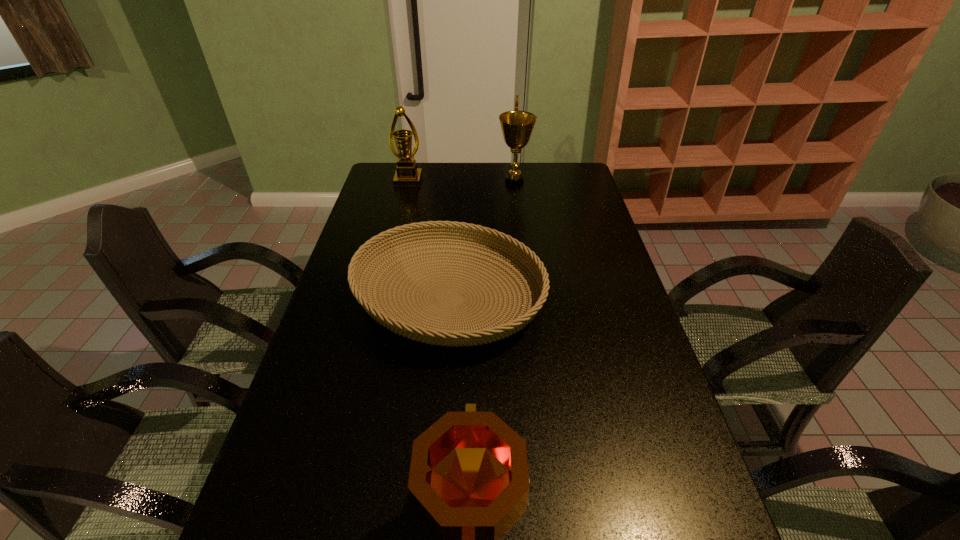
At what (x,y) coordinates should I click in order to perform the action: click on free space at the right edge of the desktop. Please return your answer as a coordinate pair (x, y). The image size is (960, 540). Looking at the image, I should click on (576, 226).

Locate an element on the screen. Image resolution: width=960 pixels, height=540 pixels. vacant region at the far left corner of the desktop is located at coordinates (372, 184).

Locate which object ranks in proximity to the third farthest object. Please provide its 2D coordinates. Your answer should be formatted as a tuple, i.e. [(x, y)], where the tuple contains the x and y coordinates of a point satisfying the conditions above.

[(468, 483)]

Identify the location of object that ranks as the second closest to the leftmost award. (490, 329).

You are a GUI agent. You are given a task and a screenshot of the screen. Output one action in this format:
    pyautogui.click(x=<x>, y=<y>)
    Task: Click on the award that can be found as the second closest to the leftmost award
    The height and width of the screenshot is (540, 960).
    Given the screenshot: What is the action you would take?
    pyautogui.click(x=468, y=483)

Identify which award is located as the second nearest to the basket. Please provide its 2D coordinates. Your answer should be formatted as a tuple, i.e. [(x, y)], where the tuple contains the x and y coordinates of a point satisfying the conditions above.

[(517, 126)]

Locate an element on the screen. Image resolution: width=960 pixels, height=540 pixels. vacant space that satisfies the following two spatial constraints: 1. on the front-facing side of the leftmost award; 2. on the right side of the basket is located at coordinates coord(378,299).